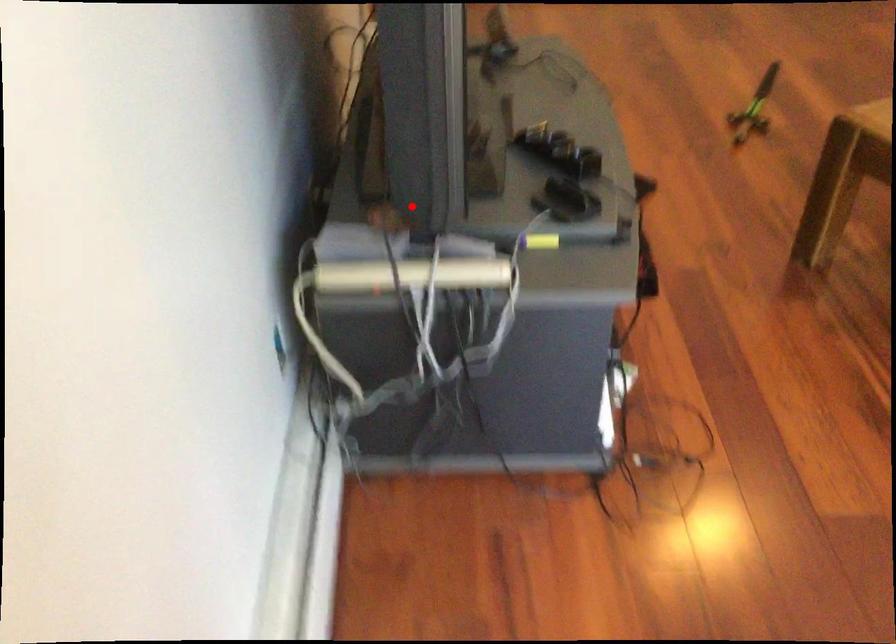
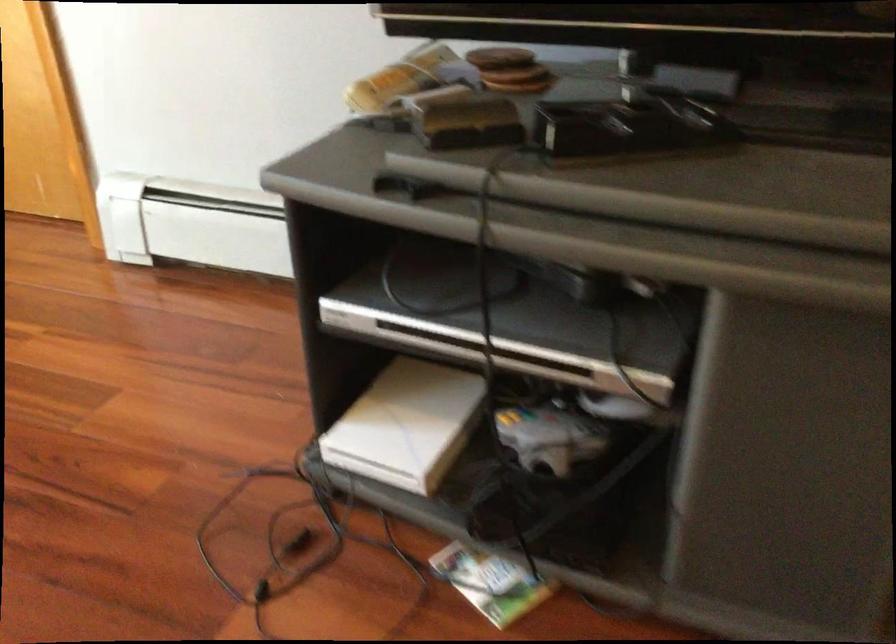
Question: I am providing you with two images of the same scene from different viewpoints. Image1 has a red point marked. In image2, the corresponding 3D location appears at what relative position? Reply with the corresponding letter.

Choices:
 (A) Closer
 (B) Farther

Answer: (A)